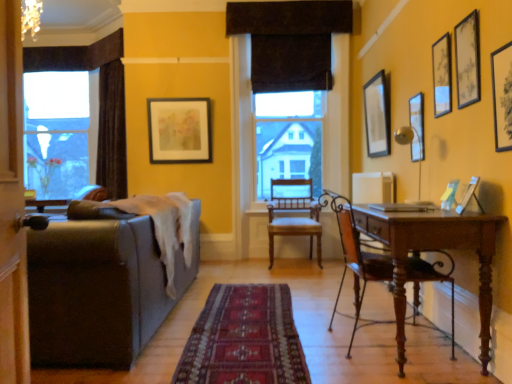
This screenshot has width=512, height=384. What do you see at coordinates (179, 130) in the screenshot?
I see `matte black picture frame at upper center, arranged as the 7th picture frame when viewed from the front` at bounding box center [179, 130].

What do you see at coordinates (417, 126) in the screenshot?
I see `matte black picture frame at upper right, the first picture frame positioned from the right` at bounding box center [417, 126].

Image resolution: width=512 pixels, height=384 pixels. I want to click on matte black picture frame at upper right, the first picture frame positioned from the right, so click(417, 126).

From the picture: In order to face brown fabric curtain at upper center, should I rotate leftwards or rightwards?

You should look right and rotate roughly 4.732 degrees.

The image size is (512, 384). Find the location of `matte black picture frame at upper center, arranged as the 7th picture frame when viewed from the front`. matte black picture frame at upper center, arranged as the 7th picture frame when viewed from the front is located at coordinates point(179,130).

From the image's perspective, is matte black picture frame at upper right, which appears as the fourth picture frame when viewed from the left, located above matte black picture frame at upper right, the seventh picture frame viewed from the left?

Yes, from the image's perspective, matte black picture frame at upper right, which appears as the fourth picture frame when viewed from the left, is on top of matte black picture frame at upper right, the seventh picture frame viewed from the left.

Considering the positions of point (479, 81) and point (420, 158), is point (479, 81) closer or farther from the camera than point (420, 158)?

Point (479, 81).

Is matte black picture frame at upper right, placed as the third picture frame when sorted from front to back, in contact with matte black picture frame at upper right, placed as the fifth picture frame when sorted from front to back?

matte black picture frame at upper right, placed as the third picture frame when sorted from front to back, and matte black picture frame at upper right, placed as the fifth picture frame when sorted from front to back, are not in contact.

Consider the image. How distant is matte black picture frame at upper right, which appears as the fourth picture frame when viewed from the right, from matte black picture frame at upper right, which is counted as the 3th picture frame, starting from the back?

matte black picture frame at upper right, which appears as the fourth picture frame when viewed from the right, is 25.19 inches away from matte black picture frame at upper right, which is counted as the 3th picture frame, starting from the back.

Is black fabric window screen at center positioned beyond the bounds of brown fabric curtain at upper center?

black fabric window screen at center is positioned outside brown fabric curtain at upper center.

From a real-world perspective, is black fabric window screen at center below brown fabric curtain at upper center?

→ Indeed, from a real-world perspective, black fabric window screen at center is positioned beneath brown fabric curtain at upper center.

Which is closer, (304, 92) or (251, 64)?

Clearly, point (304, 92) is more distant from the camera than point (251, 64).

Can you see matte black picture frame at upper right, which ranks as the 4th picture frame in back-to-front order, touching black fabric window screen at center?

No, matte black picture frame at upper right, which ranks as the 4th picture frame in back-to-front order, is not making contact with black fabric window screen at center.

How many degrees apart are the facing directions of matte black picture frame at upper right, which ranks as the 4th picture frame in back-to-front order, and black fabric window screen at center?

91.1 degrees.

This screenshot has width=512, height=384. Find the location of `the 5th picture frame to the right of the black fabric window screen at center, starting your count from the anchor`. the 5th picture frame to the right of the black fabric window screen at center, starting your count from the anchor is located at coordinates (442, 75).

Is the depth of matte black picture frame at upper right, which is the 4th picture frame in front-to-back order, less than that of black fabric window screen at center?

Yes, matte black picture frame at upper right, which is the 4th picture frame in front-to-back order, is in front of black fabric window screen at center.

Does brown fabric curtain at upper center appear on the left side of leather couch at left?

No.

Does brown fabric curtain at upper center have a lesser height compared to leather couch at left?

Correct, brown fabric curtain at upper center is not as tall as leather couch at left.

Can you tell me how much brown fabric curtain at upper center and leather couch at left differ in facing direction?

92.7 degrees.

Can you confirm if brown fabric curtain at upper center is thinner than leather couch at left?

Indeed, brown fabric curtain at upper center has a lesser width compared to leather couch at left.

Is leather couch at left shorter than matte black picture frame at upper right, acting as the sixth picture frame starting from the left?

No, leather couch at left is not shorter than matte black picture frame at upper right, acting as the sixth picture frame starting from the left.

Is leather couch at left facing away from matte black picture frame at upper right, which ranks as the 4th picture frame in back-to-front order?

No, leather couch at left is not facing the opposite direction of matte black picture frame at upper right, which ranks as the 4th picture frame in back-to-front order.

Is leather couch at left positioned far away from matte black picture frame at upper right, acting as the sixth picture frame starting from the left?

Yes.

Does leather couch at left lie behind matte black picture frame at upper right, the 2th picture frame viewed from the right?

No.

How far apart are carpeted rug at center and matte black picture frame at upper right, placed as the fifth picture frame when sorted from front to back?

1.67 meters.

In terms of width, does carpeted rug at center look wider or thinner when compared to matte black picture frame at upper right, which is counted as the 3th picture frame, starting from the back?

carpeted rug at center is wider than matte black picture frame at upper right, which is counted as the 3th picture frame, starting from the back.

Does point (208, 310) appear closer or farther from the camera than point (414, 109)?

Point (208, 310) appears to be closer to the viewer than point (414, 109).

Considering the sizes of objects carpeted rug at center and matte black picture frame at upper right, placed as the fifth picture frame when sorted from front to back, in the image provided, who is shorter, carpeted rug at center or matte black picture frame at upper right, placed as the fifth picture frame when sorted from front to back,?

carpeted rug at center is shorter.

Is point (452, 321) less distant than point (459, 102)?

Yes, point (452, 321) is closer to viewer.

Could you measure the distance between brown wood chair at right, which is the 1th chair from front to back, and matte black picture frame at upper right, which is the 5th picture frame from back to front?

brown wood chair at right, which is the 1th chair from front to back, and matte black picture frame at upper right, which is the 5th picture frame from back to front, are 3.42 feet apart from each other.

From the image's perspective, does brown wood chair at right, which is the 1th chair from front to back, appear lower than matte black picture frame at upper right, placed as the third picture frame when sorted from front to back?

Yes, from the image's perspective, brown wood chair at right, which is the 1th chair from front to back, is beneath matte black picture frame at upper right, placed as the third picture frame when sorted from front to back.

There is a matte black picture frame at upper right, the seventh picture frame viewed from the left. Where is `the 2nd picture frame above it (from the image's perspective)`? This screenshot has height=384, width=512. the 2nd picture frame above it (from the image's perspective) is located at coordinates (467, 60).

What are the coordinates of `window screen in front of the brown fabric curtain at upper center` in the screenshot? It's located at (287, 137).

Looking at the image, which one is located closer to matte black picture frame at upper right, the first picture frame positioned from the right, wooden chair at center, which is the first chair in back-to-front order, or matte black picture frame at upper center, the 1th picture frame from the left?

wooden chair at center, which is the first chair in back-to-front order.

Looking at the image, which one is located further to matte black picture frame at upper right, which ranks as the seventh picture frame in back-to-front order, brown wood chair at right, which appears as the 2th chair when viewed from the back, or matte black picture frame at upper right, which appears as the fourth picture frame when viewed from the right?

Based on the image, brown wood chair at right, which appears as the 2th chair when viewed from the back, appears to be further to matte black picture frame at upper right, which ranks as the seventh picture frame in back-to-front order.

Estimate the real-world distances between objects in this image. Which object is closer to matte black picture frame at upper right, which is counted as the 3th picture frame, starting from the back, matte black picture frame at upper right, which appears as the fourth picture frame when viewed from the left, or matte black picture frame at upper right, acting as the sixth picture frame starting from the left?

matte black picture frame at upper right, acting as the sixth picture frame starting from the left, is closer to matte black picture frame at upper right, which is counted as the 3th picture frame, starting from the back.

From the image, which object appears to be farther from brown fabric curtain at upper center, matte black picture frame at upper right, which is counted as the fifth picture frame, starting from the left, or matte black picture frame at upper right, the first picture frame positioned from the right?

matte black picture frame at upper right, the first picture frame positioned from the right, is positioned further to the anchor brown fabric curtain at upper center.

Looking at this image, based on their spatial positions, is black fabric window screen at center or matte white picture frame at right, the sixth picture frame viewed from the right, further from matte black picture frame at upper right, which appears as the fourth picture frame when viewed from the right?

The object further to matte black picture frame at upper right, which appears as the fourth picture frame when viewed from the right, is black fabric window screen at center.

Based on their spatial positions, is leather couch at left or matte black picture frame at upper right, which appears as the fourth picture frame when viewed from the left, further from matte black picture frame at upper right, the first picture frame positioned from the right?

leather couch at left lies further to matte black picture frame at upper right, the first picture frame positioned from the right, than the other object.

In the scene shown: From the image, which object appears to be nearer to brown fabric curtain at upper center, matte black picture frame at upper right, which is counted as the fifth picture frame, starting from the left, or brown wood chair at right, which is the 1th chair from front to back?

matte black picture frame at upper right, which is counted as the fifth picture frame, starting from the left, is positioned closer to the anchor brown fabric curtain at upper center.

When comparing their distances from matte black picture frame at upper right, which ranks as the seventh picture frame in back-to-front order, does matte black picture frame at upper right, which ranks as the 4th picture frame in back-to-front order, or matte black picture frame at upper right, which appears as the fourth picture frame when viewed from the right, seem closer?

matte black picture frame at upper right, which appears as the fourth picture frame when viewed from the right, is positioned closer to the anchor matte black picture frame at upper right, which ranks as the seventh picture frame in back-to-front order.

What are the coordinates of `chair between leather couch at left and brown fabric curtain at upper center in the front-back direction` in the screenshot? It's located at pos(294,217).

You are a GUI agent. You are given a task and a screenshot of the screen. Output one action in this format:
    pyautogui.click(x=<x>, y=<y>)
    Task: Click on the studio couch between brown wood chair at right, which is the 1th chair from front to back, and black fabric window screen at center from front to back
    The image size is (512, 384).
    Given the screenshot: What is the action you would take?
    pyautogui.click(x=100, y=290)

Locate an element on the screen. Image resolution: width=512 pixels, height=384 pixels. studio couch between matte black picture frame at upper right, acting as the 1th picture frame starting from the front, and brown fabric curtain at upper center in the front-back direction is located at coordinates (100, 290).

Find the location of a particular element. picture frame positioned between matte black picture frame at upper right, which appears as the fourth picture frame when viewed from the left, and matte black picture frame at upper right, the first picture frame positioned from the right, from near to far is located at coordinates (442, 75).